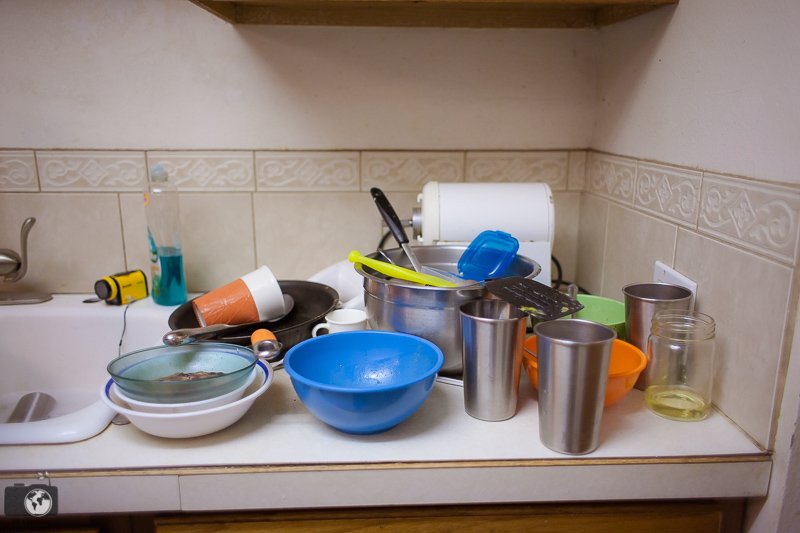
Where is `wall`? This screenshot has width=800, height=533. wall is located at coordinates (434, 90).